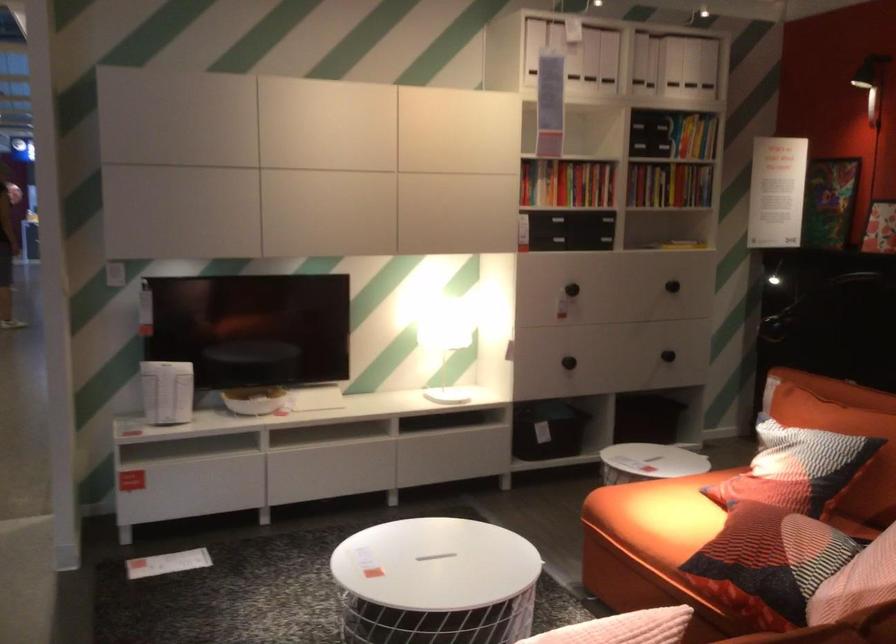
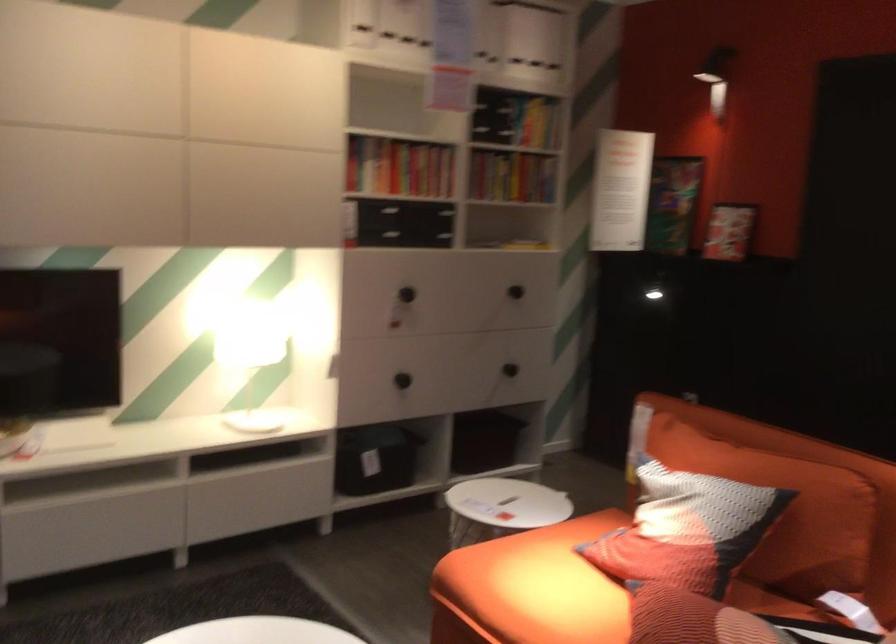
Question: The images are taken continuously from a first-person perspective. In which direction is your viewpoint rotating?

Choices:
 (A) Left
 (B) Right
 (C) Up
 (D) Down

Answer: (B)